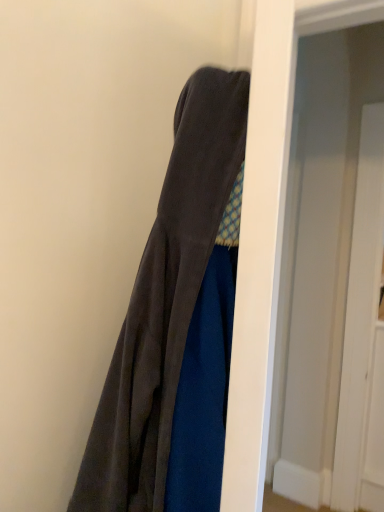
Measure the distance between point (128, 375) and camera.

31.73 inches.

What is the approximate width of velvet dark gray dress at center?

It is 12.20 inches.

What are the coordinates of `velvet dark gray dress at center` in the screenshot? It's located at [x=164, y=298].

The image size is (384, 512). What do you see at coordinates (164, 298) in the screenshot?
I see `velvet dark gray dress at center` at bounding box center [164, 298].

Where is `velvet dark gray dress at center`? This screenshot has height=512, width=384. velvet dark gray dress at center is located at coordinates (164, 298).